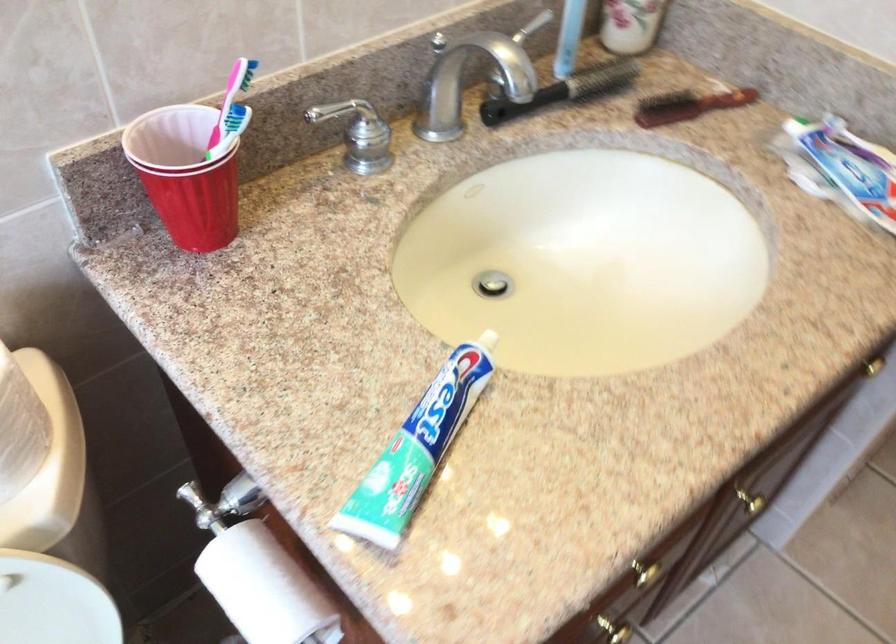
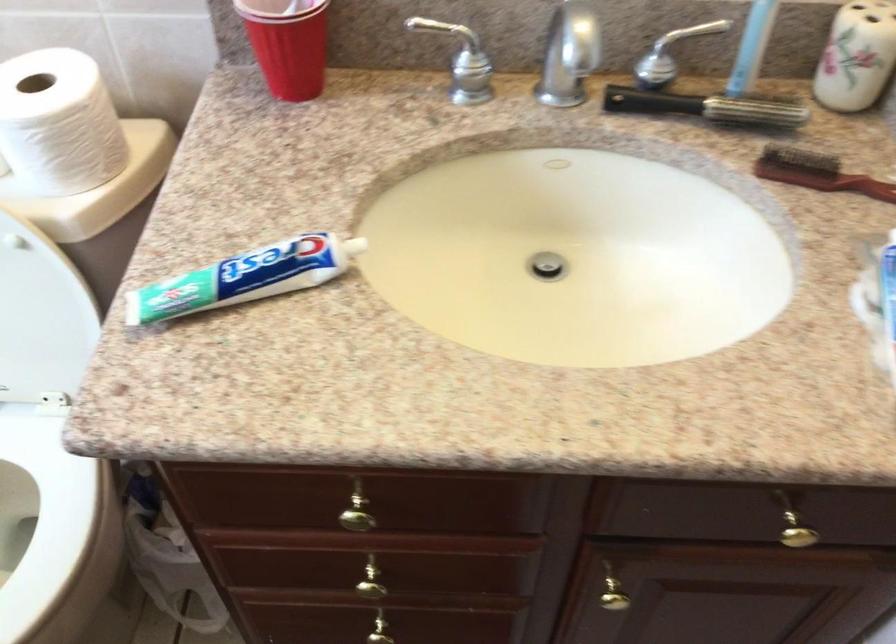
In the second image, find the point that corresponds to point (328, 120) in the first image.

(455, 44)